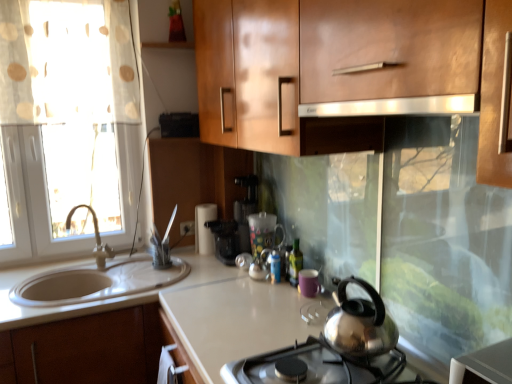
The width and height of the screenshot is (512, 384). In order to click on free space in front of black plastic coffee machine at center in this screenshot , I will do `click(221, 275)`.